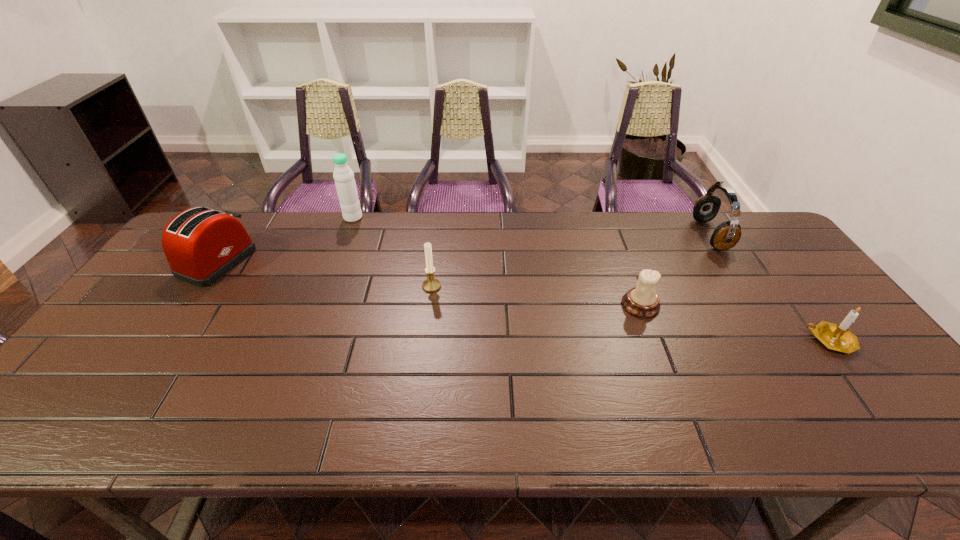
The image size is (960, 540). In order to click on free space that satisfies the following two spatial constraints: 1. on the front side of the nearest candle holder; 2. on the right side of the fourth object from left to right in this screenshot , I will do `click(654, 341)`.

Find the location of `free spot that satisfies the following two spatial constraints: 1. on the back side of the rightmost object; 2. on the ear cups of the second object from right to left`. free spot that satisfies the following two spatial constraints: 1. on the back side of the rightmost object; 2. on the ear cups of the second object from right to left is located at coordinates (750, 234).

Where is `free location that satisfies the following two spatial constraints: 1. on the front side of the rightmost candle holder; 2. on the right side of the leftmost object`? free location that satisfies the following two spatial constraints: 1. on the front side of the rightmost candle holder; 2. on the right side of the leftmost object is located at coordinates coord(162,341).

This screenshot has height=540, width=960. Find the location of `free space that satisfies the following two spatial constraints: 1. on the front side of the third object from left to right; 2. on the left side of the toaster`. free space that satisfies the following two spatial constraints: 1. on the front side of the third object from left to right; 2. on the left side of the toaster is located at coordinates (200, 286).